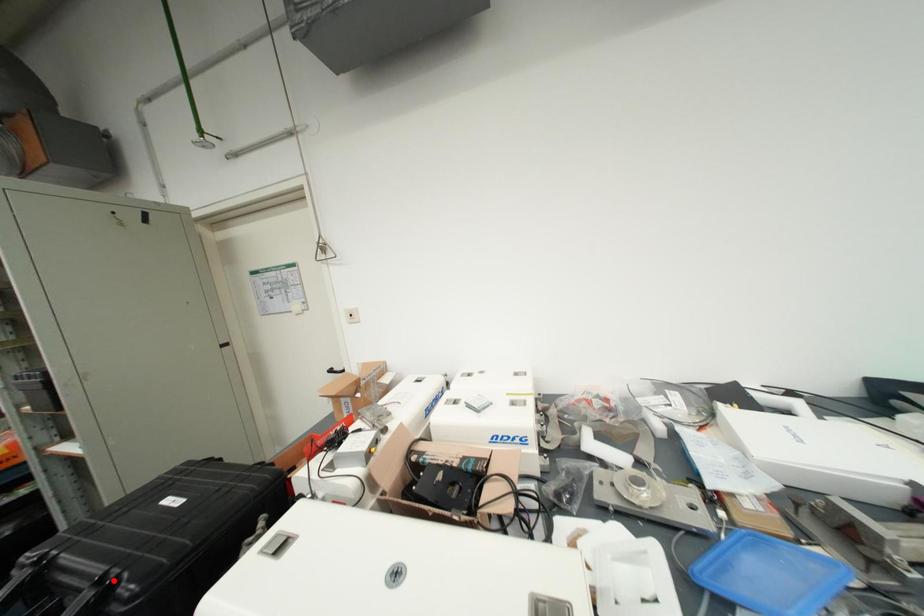
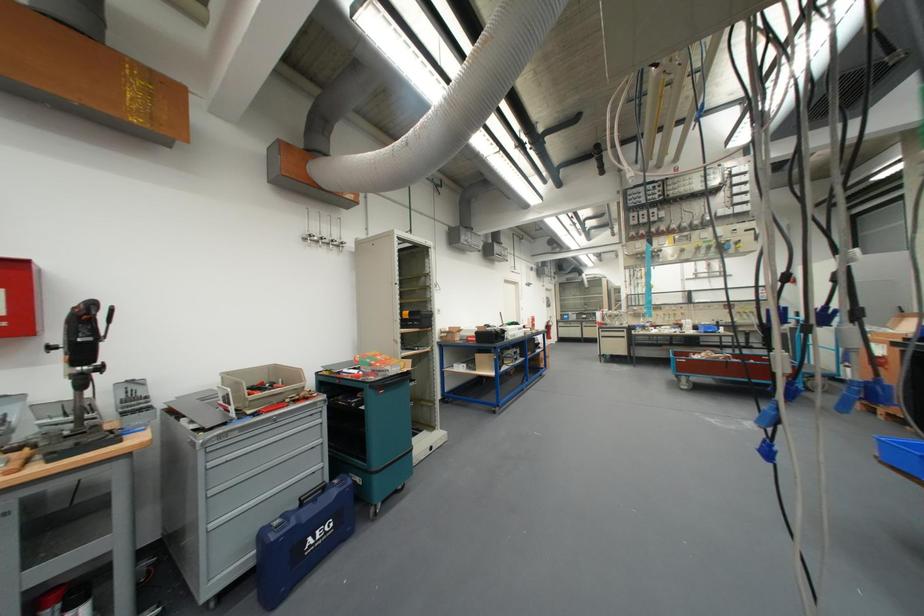
Question: I am providing you with two images of the same scene from different viewpoints. A red point is marked on the first image. Can you still see the location of the red point in image 2?

Choices:
 (A) Yes
 (B) No

Answer: (B)